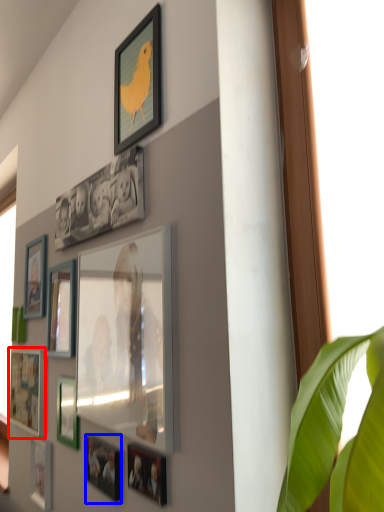
Question: Which of the following is the farthest to the observer, picture frame (highlighted by a red box) or picture frame (highlighted by a blue box)?

Choices:
 (A) picture frame
 (B) picture frame

Answer: (A)